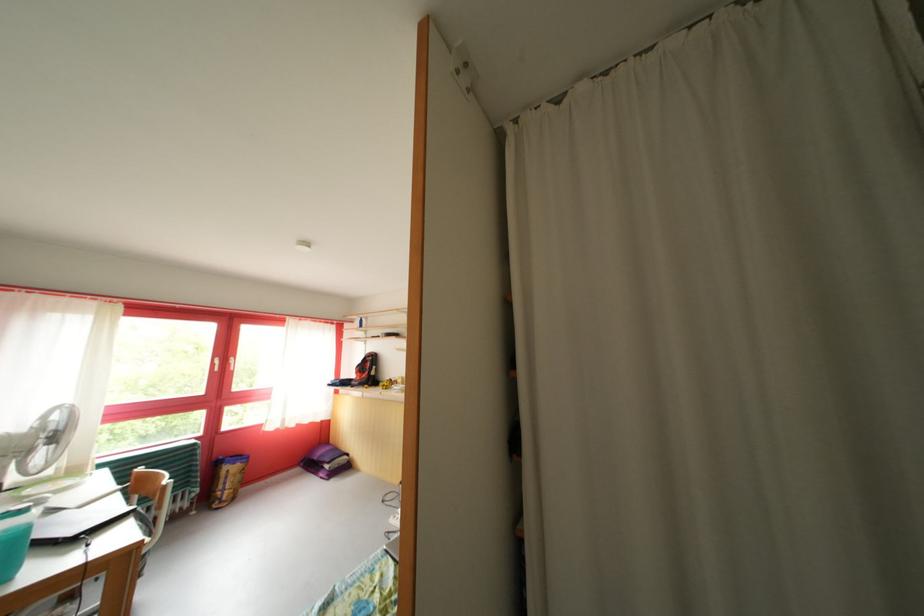
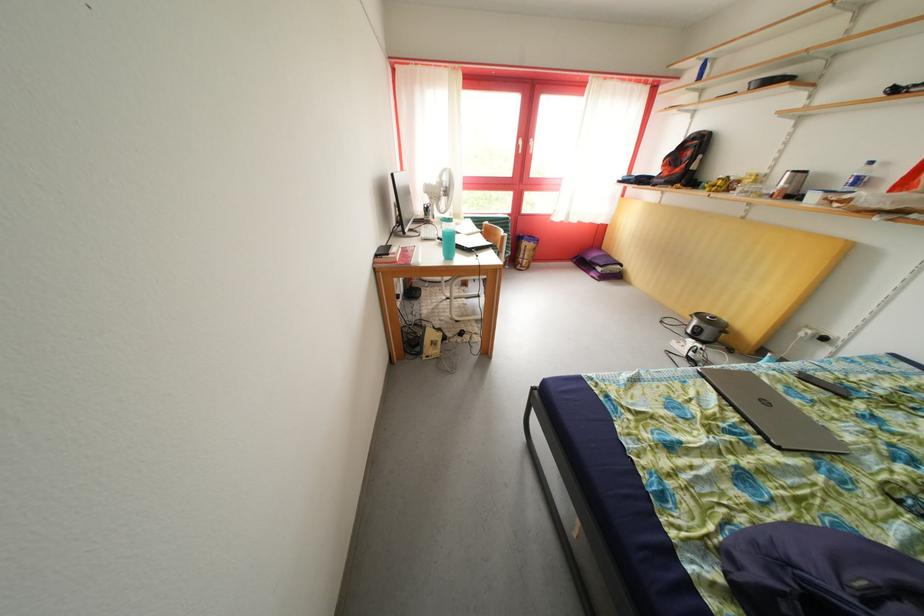
The point at [334,472] is marked in the first image. Where is the corresponding point in the second image?

(608, 275)